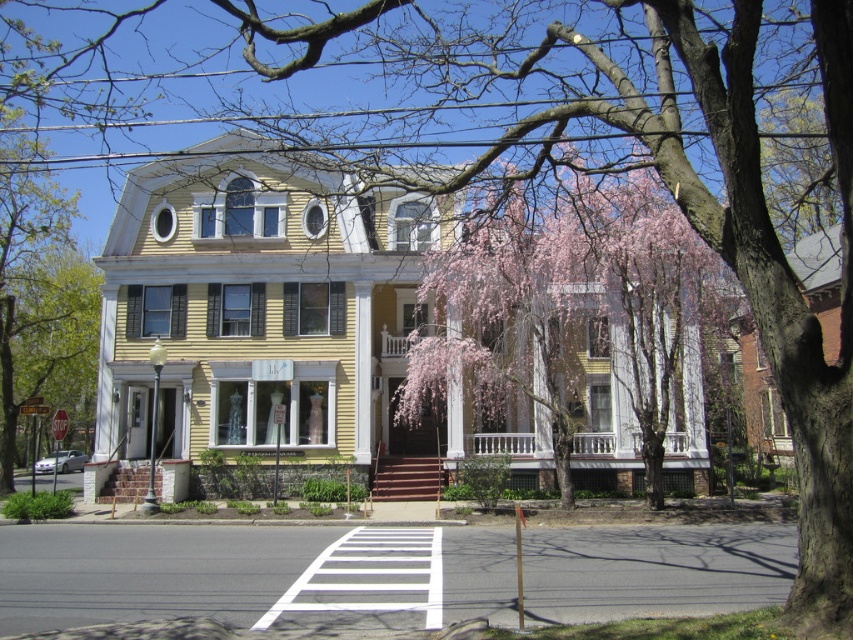
How much distance is there between pink blossoming branches at center and white painted wood porch at center?

pink blossoming branches at center and white painted wood porch at center are 5.83 meters apart.

Is point (646, 422) positioned behind point (589, 451)?

No, it is not.

Does point (639, 253) come behind point (631, 435)?

That is False.

Identify the location of pink blossoming branches at center. (566, 314).